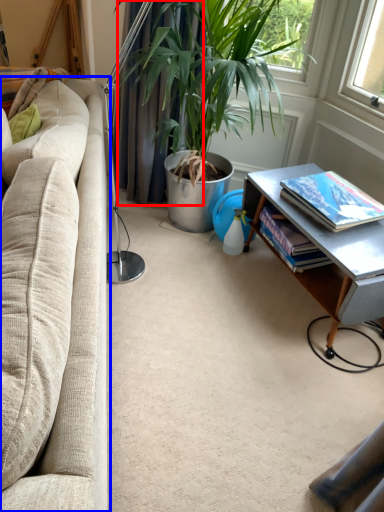
Question: Which of the following is the farthest to the observer, curtain (highlighted by a red box) or studio couch (highlighted by a blue box)?

Choices:
 (A) curtain
 (B) studio couch

Answer: (A)